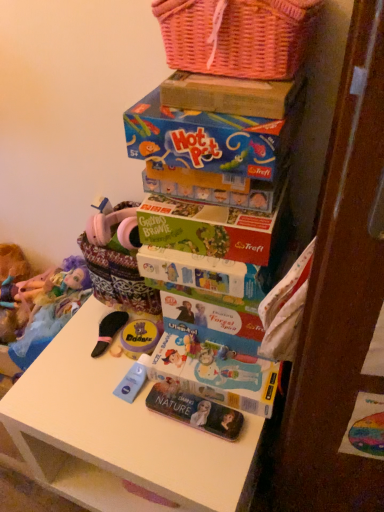
The image size is (384, 512). Find the location of `blank space situated above matt paper comic book at center (from a real-world perspective)`. blank space situated above matt paper comic book at center (from a real-world perspective) is located at coordinates (220, 355).